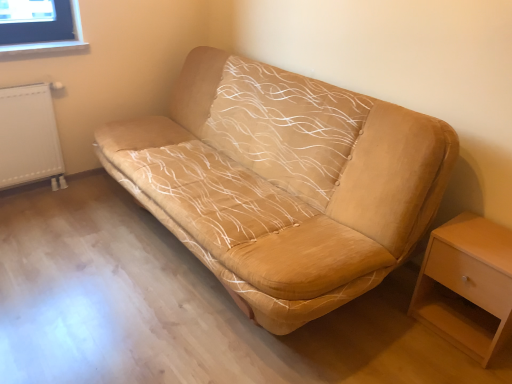
This screenshot has height=384, width=512. Describe the element at coordinates (283, 182) in the screenshot. I see `beige suede sofa at center` at that location.

Locate an element on the screen. Image resolution: width=512 pixels, height=384 pixels. light wood/wooden nightstand at lower right is located at coordinates (467, 285).

Image resolution: width=512 pixels, height=384 pixels. What are the coordinates of `beige suede sofa at center` in the screenshot? It's located at (283, 182).

Which of these two, white textured radiator at left or light wood/wooden nightstand at lower right, is bigger?

With larger size is light wood/wooden nightstand at lower right.

From the image's perspective, which object appears higher, white textured radiator at left or light wood/wooden nightstand at lower right?

white textured radiator at left.

Can light wood/wooden nightstand at lower right be found inside white textured radiator at left?

No, white textured radiator at left does not contain light wood/wooden nightstand at lower right.

Is white textured radiator at left closer to the viewer compared to light wood/wooden nightstand at lower right?

No, the depth of white textured radiator at left is greater than that of light wood/wooden nightstand at lower right.

Could you tell me if beige suede sofa at center is facing white textured radiator at left?

Yes.

From a real-world perspective, between beige suede sofa at center and white textured radiator at left, who is vertically lower?

white textured radiator at left.

Are beige suede sofa at center and white textured radiator at left making contact?

No.

Considering the relative sizes of beige suede sofa at center and white textured radiator at left in the image provided, is beige suede sofa at center smaller than white textured radiator at left?

Incorrect, beige suede sofa at center is not smaller in size than white textured radiator at left.

Considering the points (504, 232) and (2, 101), which point is behind, point (504, 232) or point (2, 101)?

Point (2, 101)

Is light wood/wooden nightstand at lower right aimed at white textured radiator at left?

No.

Is light wood/wooden nightstand at lower right wider than white textured radiator at left?

Correct, the width of light wood/wooden nightstand at lower right exceeds that of white textured radiator at left.

From the picture: Considering the sizes of light wood/wooden nightstand at lower right and white textured radiator at left in the image, is light wood/wooden nightstand at lower right taller or shorter than white textured radiator at left?

Clearly, light wood/wooden nightstand at lower right is shorter compared to white textured radiator at left.

Considering the relative positions of light wood/wooden nightstand at lower right and beige suede sofa at center in the image provided, is light wood/wooden nightstand at lower right to the right of beige suede sofa at center from the viewer's perspective?

Indeed, light wood/wooden nightstand at lower right is positioned on the right side of beige suede sofa at center.

In the scene shown: Which object is further away from the camera taking this photo, light wood/wooden nightstand at lower right or beige suede sofa at center?

Positioned behind is light wood/wooden nightstand at lower right.

Which point is more distant from viewer, (464, 327) or (247, 179)?

Positioned behind is point (247, 179).

Is white textured radiator at left inside the boundaries of beige suede sofa at center, or outside?

white textured radiator at left is located beyond the bounds of beige suede sofa at center.

From the image's perspective, between white textured radiator at left and beige suede sofa at center, who is located below?

beige suede sofa at center.

Is white textured radiator at left in front of or behind beige suede sofa at center in the image?

Visually, white textured radiator at left is located behind beige suede sofa at center.

Looking at this image, from a real-world perspective, which object rests below the other?

light wood/wooden nightstand at lower right, from a real-world perspective.

Are beige suede sofa at center and light wood/wooden nightstand at lower right located far from each other?

No, beige suede sofa at center is not far away from light wood/wooden nightstand at lower right.

In the image, is beige suede sofa at center positioned in front of or behind light wood/wooden nightstand at lower right?

beige suede sofa at center is in front of light wood/wooden nightstand at lower right.

The height and width of the screenshot is (384, 512). I want to click on radiator above the light wood/wooden nightstand at lower right (from the image's perspective), so click(x=28, y=136).

At what (x,y) coordinates should I click in order to perform the action: click on studio couch on the right of white textured radiator at left. Please return your answer as a coordinate pair (x, y). Looking at the image, I should click on (283, 182).

When comparing their distances from beige suede sofa at center, does white textured radiator at left or light wood/wooden nightstand at lower right seem closer?

Among the two, light wood/wooden nightstand at lower right is located nearer to beige suede sofa at center.

Which object lies nearer to the anchor point light wood/wooden nightstand at lower right, beige suede sofa at center or white textured radiator at left?

beige suede sofa at center is closer to light wood/wooden nightstand at lower right.

Looking at the image, which one is located closer to white textured radiator at left, beige suede sofa at center or light wood/wooden nightstand at lower right?

beige suede sofa at center is closer to white textured radiator at left.

Which object lies further to the anchor point beige suede sofa at center, light wood/wooden nightstand at lower right or white textured radiator at left?

Based on the image, white textured radiator at left appears to be further to beige suede sofa at center.

Considering their positions, is white textured radiator at left positioned closer to light wood/wooden nightstand at lower right than beige suede sofa at center?

Among the two, beige suede sofa at center is located nearer to light wood/wooden nightstand at lower right.

Looking at the image, which one is located closer to white textured radiator at left, light wood/wooden nightstand at lower right or beige suede sofa at center?

Among the two, beige suede sofa at center is located nearer to white textured radiator at left.

At what (x,y) coordinates should I click in order to perform the action: click on studio couch situated between white textured radiator at left and light wood/wooden nightstand at lower right from left to right. Please return your answer as a coordinate pair (x, y). The height and width of the screenshot is (384, 512). Looking at the image, I should click on (283, 182).